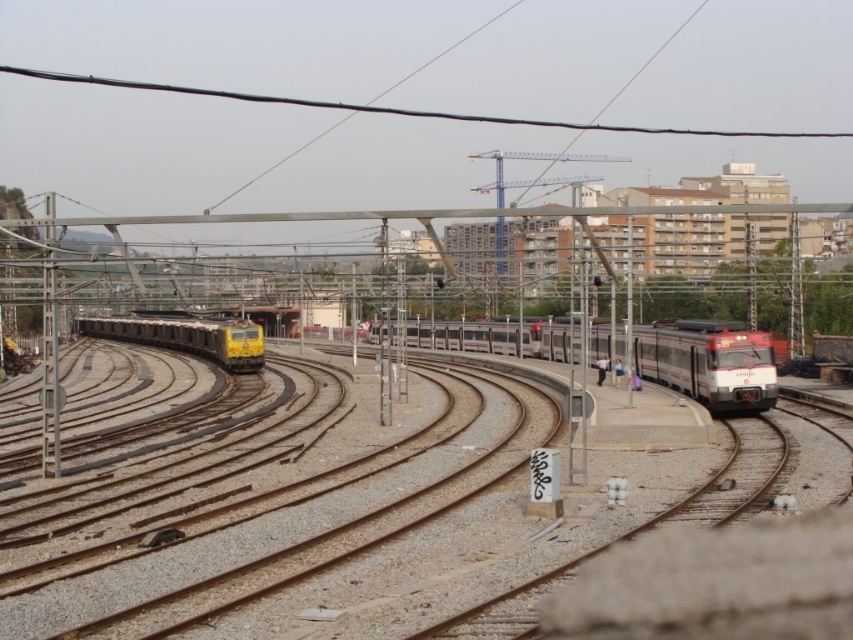
Is yellow metallic train at left taller than red glossy train at center?

Incorrect, yellow metallic train at left's height is not larger of red glossy train at center's.

Consider the image. Can you confirm if yellow metallic train at left is shorter than red glossy train at center?

Correct, yellow metallic train at left is not as tall as red glossy train at center.

In order to click on yellow metallic train at left in this screenshot , I will do `click(344, 493)`.

Which is behind, point (469, 376) or point (207, 353)?

Point (207, 353)

Is yellow metallic train at left taller than yellow metallic train at center?

In fact, yellow metallic train at left may be shorter than yellow metallic train at center.

Measure the distance between yellow metallic train at left and camera.

yellow metallic train at left is 9.40 meters from camera.

Image resolution: width=853 pixels, height=640 pixels. What are the coordinates of `yellow metallic train at left` in the screenshot? It's located at (344, 493).

Locate an element on the screen. The width and height of the screenshot is (853, 640). smooth wire at upper center is located at coordinates (402, 108).

Is point (456, 115) positioned behind point (161, 346)?

That is True.

Where is `smooth wire at upper center`? This screenshot has width=853, height=640. smooth wire at upper center is located at coordinates (402, 108).